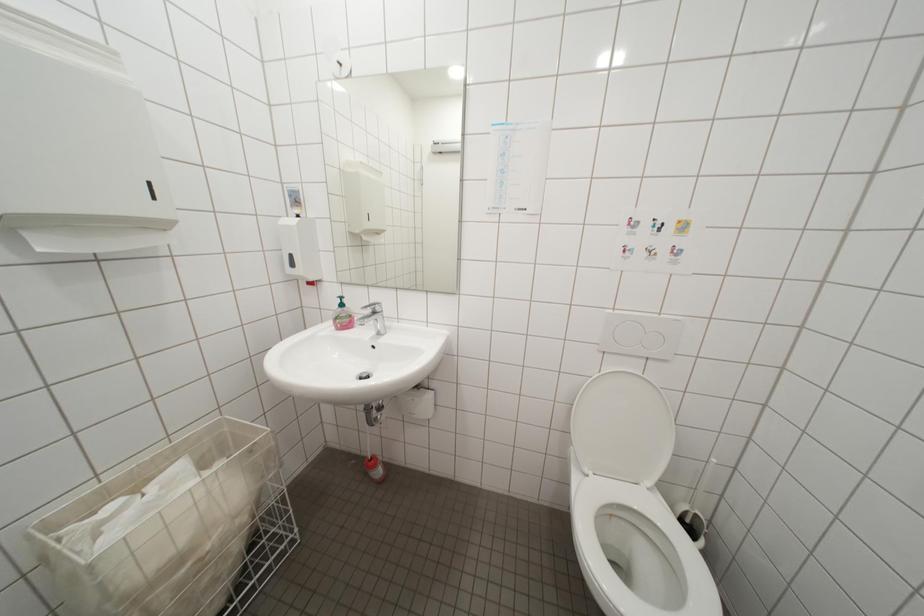
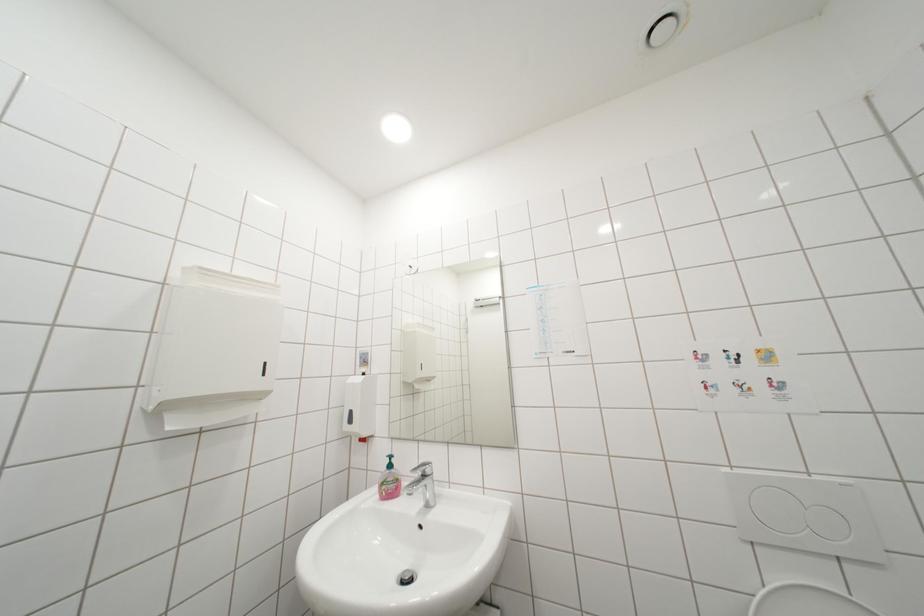
Question: The images are taken continuously from a first-person perspective. In which direction is your viewpoint rotating?

Choices:
 (A) Left
 (B) Right
 (C) Up
 (D) Down

Answer: (C)